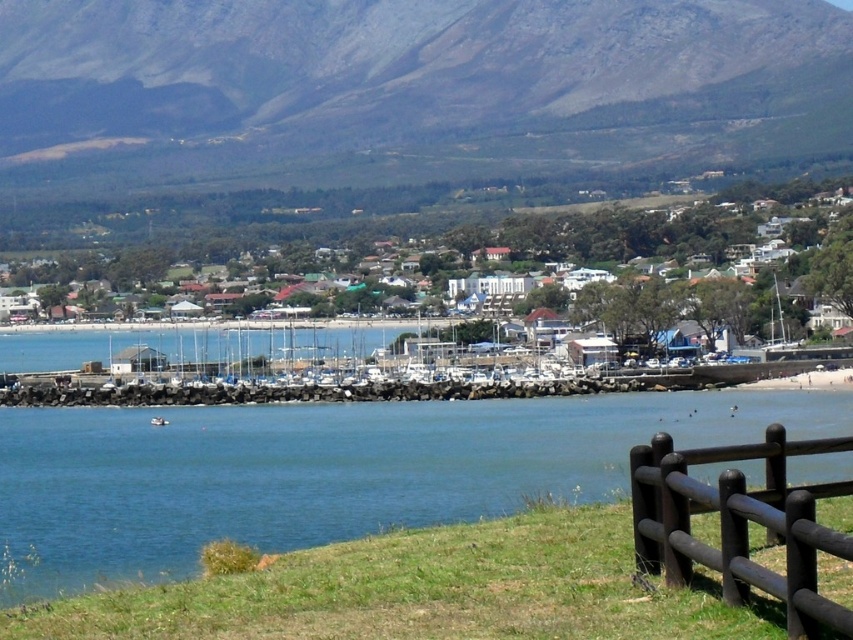
Is point (180, 152) farther from camera compared to point (151, 417)?

Yes, it is.

What do you see at coordinates (408, 83) in the screenshot? I see `gray rocky mountain at upper center` at bounding box center [408, 83].

Find the location of a particular element. gray rocky mountain at upper center is located at coordinates (408, 83).

Is point (364, 464) positioned behind point (152, 420)?

No, it is not.

In the scene shown: Can you confirm if blue water at center is smaller than white plastic boat at lower center?

No, blue water at center is not smaller than white plastic boat at lower center.

Does point (480, 428) come behind point (149, 424)?

No, it is in front of (149, 424).

This screenshot has height=640, width=853. I want to click on blue water at center, so click(x=329, y=468).

Can you confirm if blue water at center is positioned to the right of brown wooden fence at lower right?

No, blue water at center is not to the right of brown wooden fence at lower right.

Is blue water at center shorter than brown wooden fence at lower right?

No.

Is point (158, 524) farther from viewer compared to point (743, 499)?

Yes, point (158, 524) is farther from viewer.

This screenshot has height=640, width=853. What are the coordinates of `blue water at center` in the screenshot? It's located at (329, 468).